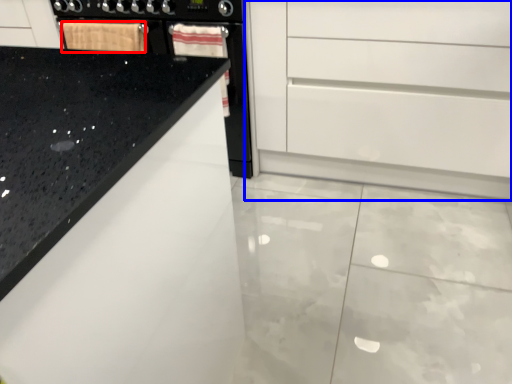
Question: Which object appears farthest to the camera in this image, material (highlighted by a red box) or chest of drawers (highlighted by a blue box)?

Choices:
 (A) material
 (B) chest of drawers

Answer: (A)